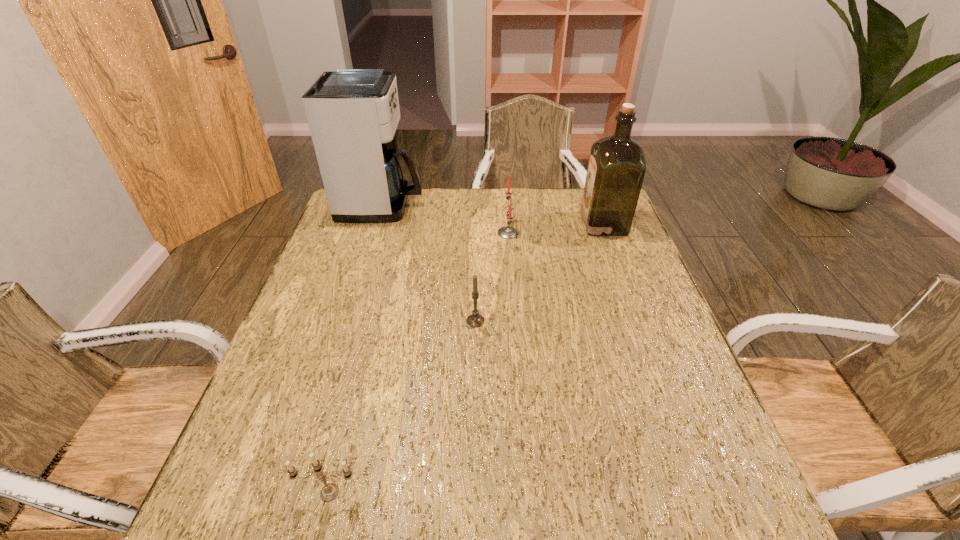
The height and width of the screenshot is (540, 960). In order to click on empty location between the farthest candle and the liquor in this screenshot , I will do `click(556, 228)`.

The height and width of the screenshot is (540, 960). Identify the location of unoccupied area between the liquor and the nearest candle. (467, 358).

Choose which object is the second nearest neighbor to the rightmost object. Please provide its 2D coordinates. Your answer should be formatted as a tuple, i.e. [(x, y)], where the tuple contains the x and y coordinates of a point satisfying the conditions above.

[(475, 319)]

Where is `object that stands as the third closest to the rightmost object`? The width and height of the screenshot is (960, 540). object that stands as the third closest to the rightmost object is located at coordinates (353, 114).

At what (x,y) coordinates should I click in order to perform the action: click on the closest candle to the nearest candle. Please return your answer as a coordinate pair (x, y). The height and width of the screenshot is (540, 960). Looking at the image, I should click on (475, 319).

You are a GUI agent. You are given a task and a screenshot of the screen. Output one action in this format:
    pyautogui.click(x=<x>, y=<y>)
    Task: Click on the candle object that ranks as the closest to the farthest candle
    The image size is (960, 540).
    Given the screenshot: What is the action you would take?
    pyautogui.click(x=475, y=319)

At what (x,y) coordinates should I click in order to perform the action: click on vacant space that satisfies the following two spatial constraints: 1. on the front panel of the coffee maker; 2. on the left side of the nearest object. Please return your answer as a coordinate pair (x, y). Image resolution: width=960 pixels, height=540 pixels. Looking at the image, I should click on (292, 492).

The height and width of the screenshot is (540, 960). I want to click on free spot that satisfies the following two spatial constraints: 1. on the front panel of the leftmost candle; 2. on the left side of the coffee maker, so click(292, 492).

Locate an element on the screen. vacant region that satisfies the following two spatial constraints: 1. on the front panel of the third object from right to left; 2. on the left side of the coffee maker is located at coordinates (346, 321).

The height and width of the screenshot is (540, 960). In order to click on free space that satisfies the following two spatial constraints: 1. on the front panel of the coffee maker; 2. on the right side of the second farthest candle in this screenshot , I will do point(346,321).